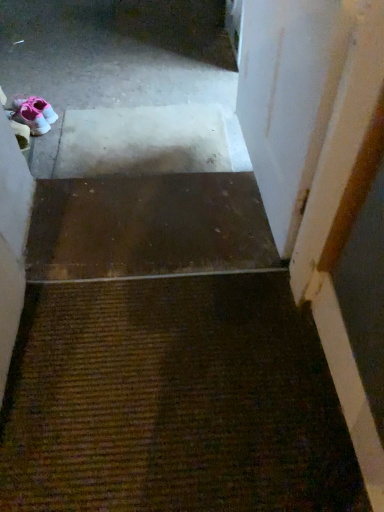
Where is `blank space situated above brown matte stair at center (from a real-world perspective)`? The width and height of the screenshot is (384, 512). blank space situated above brown matte stair at center (from a real-world perspective) is located at coordinates (162, 221).